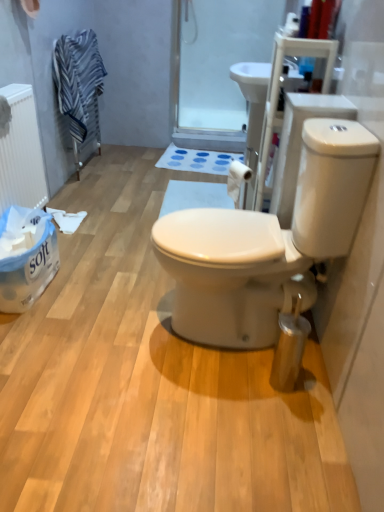
Where is `free spot in front of white glossy toilet at center`? This screenshot has height=512, width=384. free spot in front of white glossy toilet at center is located at coordinates (220, 420).